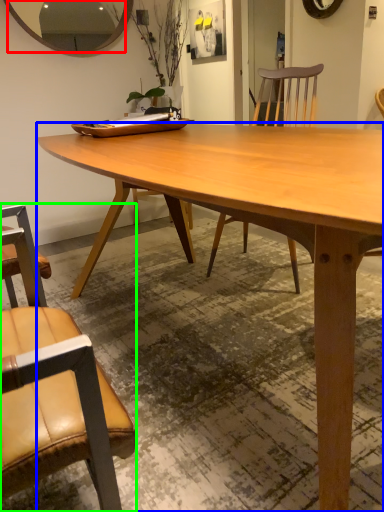
Question: Which object is positioned closest to mirror (highlighted by a red box)? Select from desk (highlighted by a blue box) and chair (highlighted by a green box).

Choices:
 (A) desk
 (B) chair

Answer: (A)